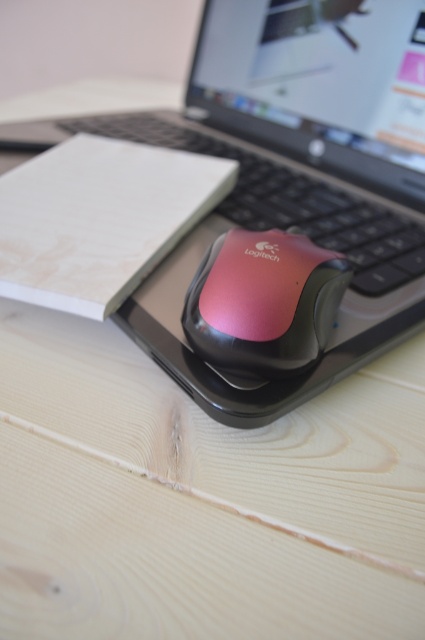
At what (x,y) coordinates should I click in order to perform the action: click on black plastic computer at center. Please return your answer as a coordinate pair (x, y). The image size is (425, 640). Looking at the image, I should click on (291, 173).

Who is positioned more to the right, black plastic computer at center or black rubber mousepad at center?

From the viewer's perspective, black plastic computer at center appears more on the right side.

Who is more distant from viewer, (x=268, y=417) or (x=3, y=252)?

Point (x=3, y=252)

Locate an element on the screen. The image size is (425, 640). black plastic computer at center is located at coordinates (291, 173).

Is black plastic computer at center positioned behind pink glossy mouse at center?

That is True.

Who is taller, black plastic computer at center or pink glossy mouse at center?

black plastic computer at center is taller.

Which is in front, point (229, 397) or point (331, 285)?

Point (229, 397) is more forward.

Where is `black plastic computer at center`? The height and width of the screenshot is (640, 425). black plastic computer at center is located at coordinates (291, 173).

Is black plastic computer at center further to the viewer compared to black plastic keyboard at center?

No, black plastic computer at center is closer to the viewer.

Does black plastic computer at center appear under black plastic keyboard at center?

Actually, black plastic computer at center is above black plastic keyboard at center.

Image resolution: width=425 pixels, height=640 pixels. In order to click on black plastic computer at center in this screenshot , I will do `click(291, 173)`.

Image resolution: width=425 pixels, height=640 pixels. What are the coordinates of `black plastic computer at center` in the screenshot? It's located at (291, 173).